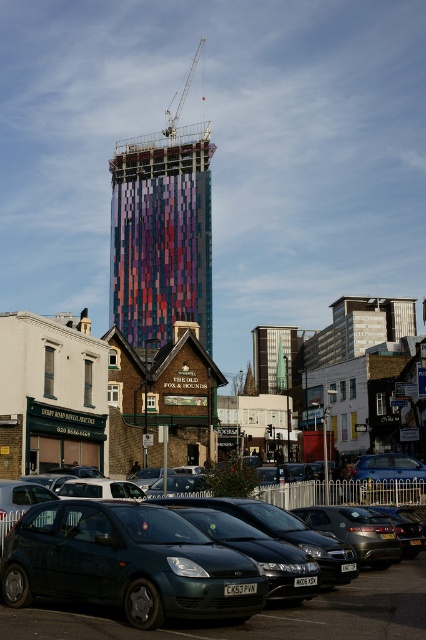
Question: Which object appears farthest from the camera in this image?

Choices:
 (A) metallic gray crane at upper center
 (B) metallic gray hatchback at center

Answer: (A)

Question: Which object is the closest to the metallic gray hatchback at center?

Choices:
 (A) metallic gray crane at upper center
 (B) multicolored mosaic building at center
 (C) metallic green hatchback at center

Answer: (C)

Question: Can you confirm if multicolored mosaic building at center is thinner than metallic gray hatchback at center?

Choices:
 (A) no
 (B) yes

Answer: (A)

Question: Can you confirm if metallic gray hatchback at center is positioned to the right of metallic gray crane at upper center?

Choices:
 (A) yes
 (B) no

Answer: (A)

Question: Considering the real-world distances, which object is farthest from the metallic gray hatchback at center?

Choices:
 (A) multicolored mosaic building at center
 (B) metallic gray crane at upper center

Answer: (B)

Question: Can you confirm if multicolored mosaic building at center is smaller than metallic gray hatchback at center?

Choices:
 (A) yes
 (B) no

Answer: (B)